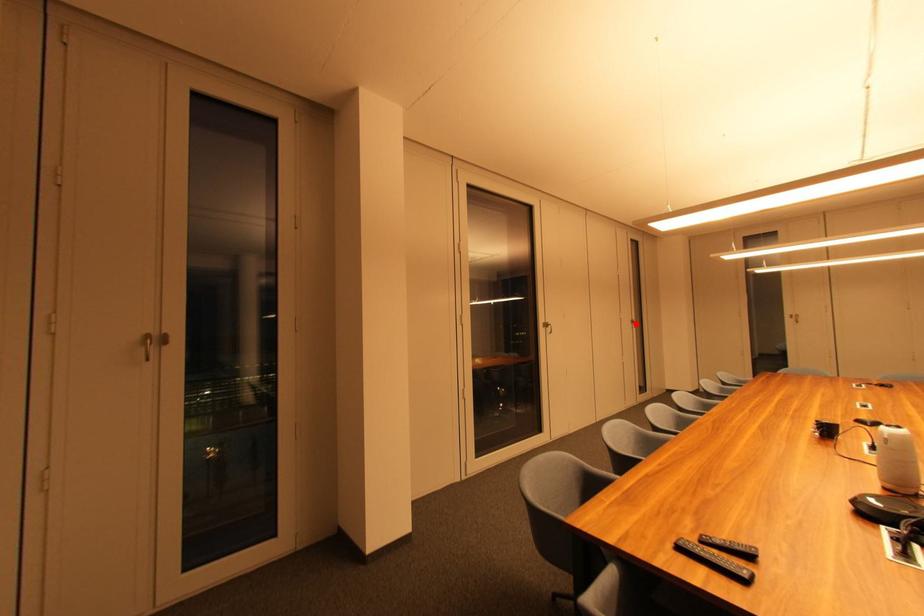
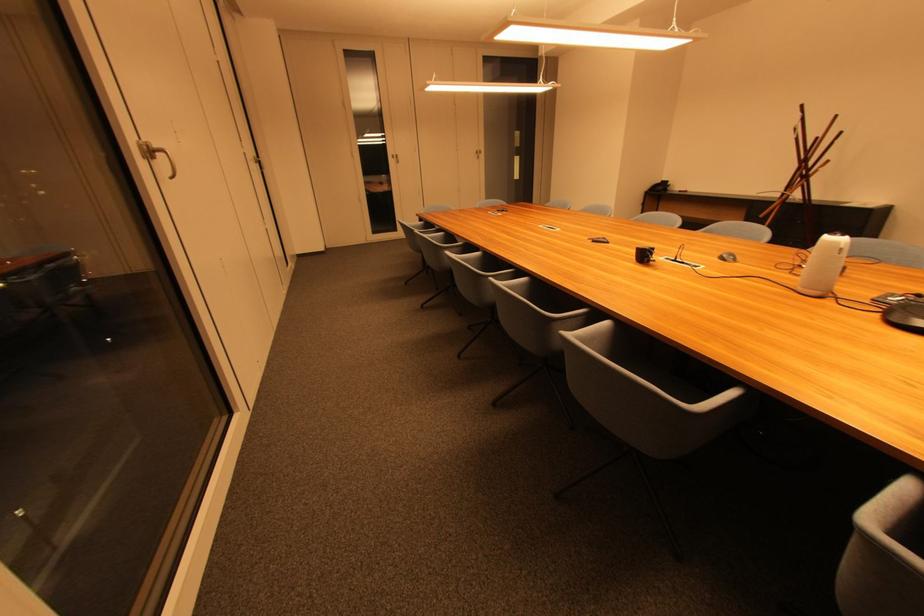
Question: A red point is marked in image1. In image2, is the corresponding 3D point closer to the camera or farther? Reply with the corresponding letter.

Choices:
 (A) The corresponding 3D point is closer.
 (B) The corresponding 3D point is farther.

Answer: (A)